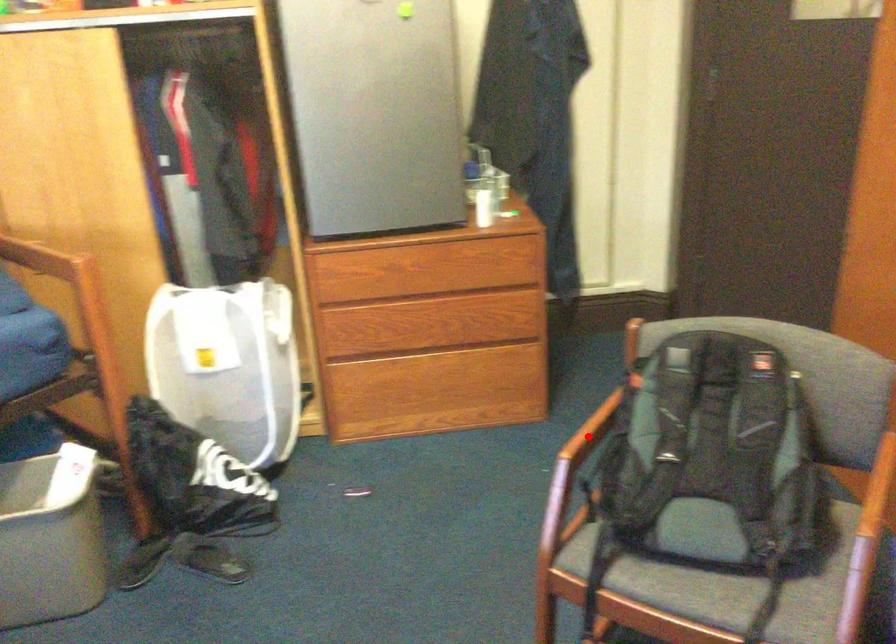
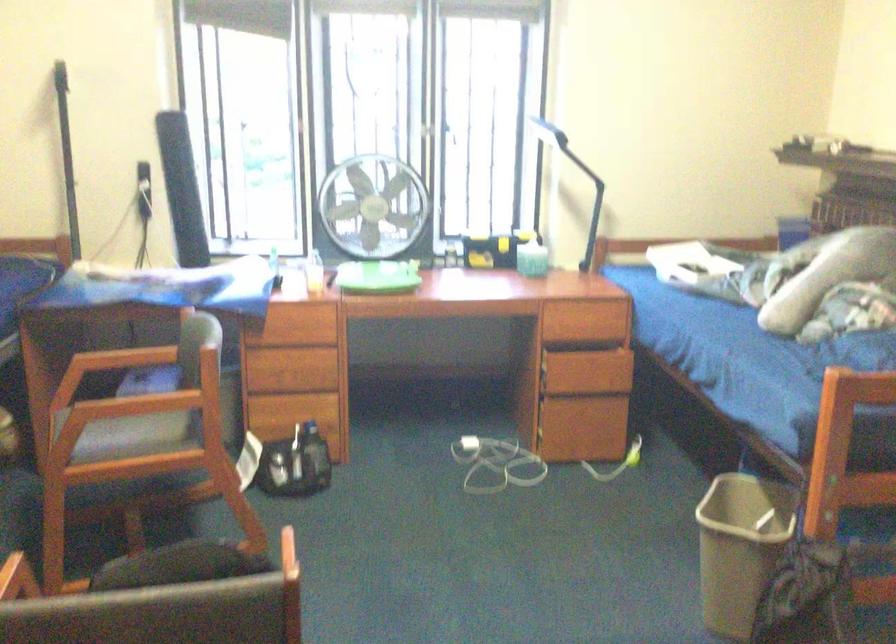
Question: I am providing you with two images of the same scene from different viewpoints. A red point is marked on the first image. Can you still see the location of the red point in image 2?

Choices:
 (A) Yes
 (B) No

Answer: (B)